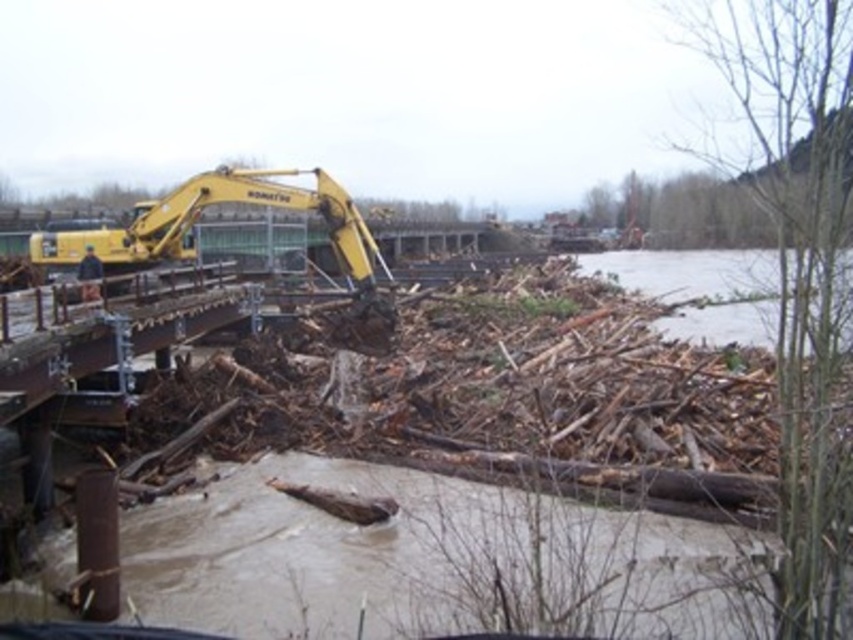
You are a construction worker who needs to cross from the excavator to the water to check the water quality. Is the path between the yellow metallic excavator at upper left and the brown muddy water at lower right passable?

The yellow metallic excavator at upper left is to the left of brown muddy water at lower right, so the path between them is passable as they are positioned side by side horizontally.

You are a construction worker who needs to move a heavy log from the debris pile to the riverbank. Which excavator, the yellow rubber excavator at upper left or the yellow metallic excavator at upper left, should you choose for the job?

You should choose the yellow rubber excavator at upper left because it is larger in size than the yellow metallic excavator at upper left, making it more capable of handling heavy logs.

You are a construction worker assessing the site layout. You need to determine if there is enough space to maneuver the yellow metallic excavator at upper left around the brown muddy water at lower right. Based on their sizes, can you confirm if this is possible?

The yellow metallic excavator at upper left occupies less space than brown muddy water at lower right, so there should be sufficient space to maneuver the excavator around the muddy water area.